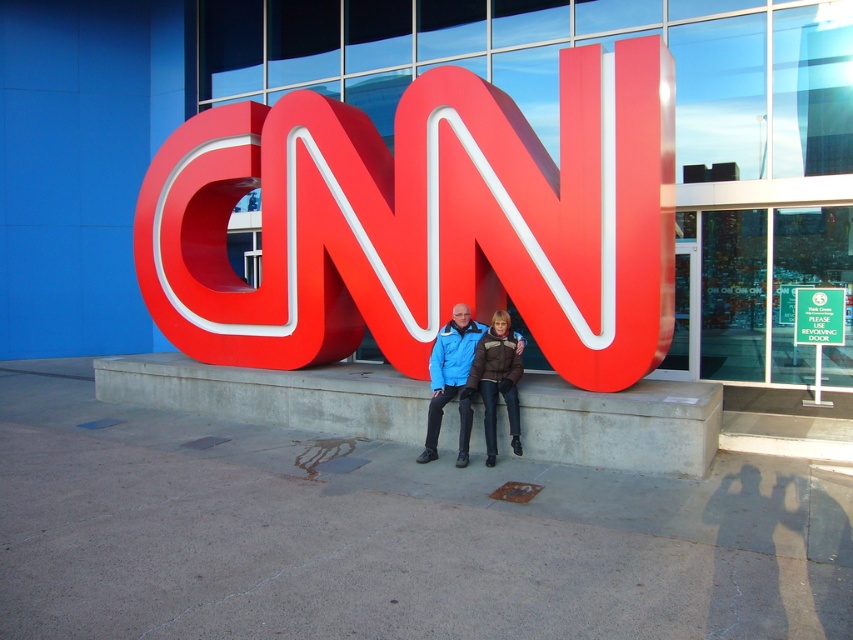
You are a photographer trying to capture the CNN logo and the individuals sitting on its base. To ensure the blue jacket at center is in focus, where should you position the camera focus point? Please provide coordinates in the format of a point like point (451, 380).

The point corresponding to the matte blue jacket at center is point (451, 380). Therefore, you should position the camera focus point at point (451, 380) to ensure the blue jacket at center is in focus.